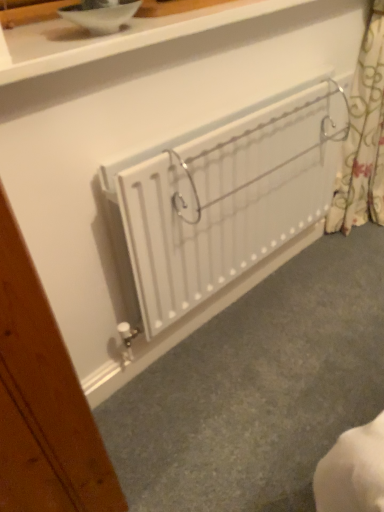
Question: Is floral fabric curtain at right inside the boundaries of white matte radiator at center, or outside?

Choices:
 (A) outside
 (B) inside

Answer: (A)

Question: From a real-world perspective, is floral fabric curtain at right positioned above or below white matte radiator at center?

Choices:
 (A) below
 (B) above

Answer: (B)

Question: In terms of width, does floral fabric curtain at right look wider or thinner when compared to white matte radiator at center?

Choices:
 (A) thin
 (B) wide

Answer: (B)

Question: Is white matte radiator at center inside or outside of floral fabric curtain at right?

Choices:
 (A) outside
 (B) inside

Answer: (A)

Question: In the image, is white matte radiator at center on the left side or the right side of floral fabric curtain at right?

Choices:
 (A) right
 (B) left

Answer: (B)

Question: From a real-world perspective, is white matte radiator at center positioned above or below floral fabric curtain at right?

Choices:
 (A) below
 (B) above

Answer: (A)

Question: Based on their sizes in the image, would you say white matte radiator at center is bigger or smaller than floral fabric curtain at right?

Choices:
 (A) big
 (B) small

Answer: (A)